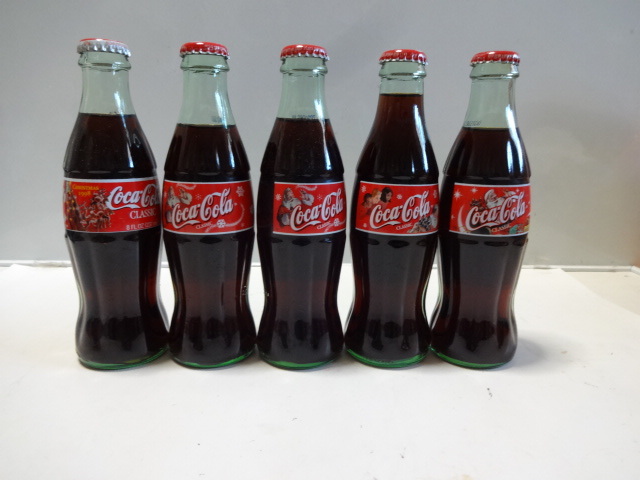
At what (x,y) coordinates should I click in order to perform the action: click on bottles. Please return your answer as a coordinate pair (x, y). Looking at the image, I should click on (112, 279), (218, 293), (292, 289), (404, 293), (484, 295).